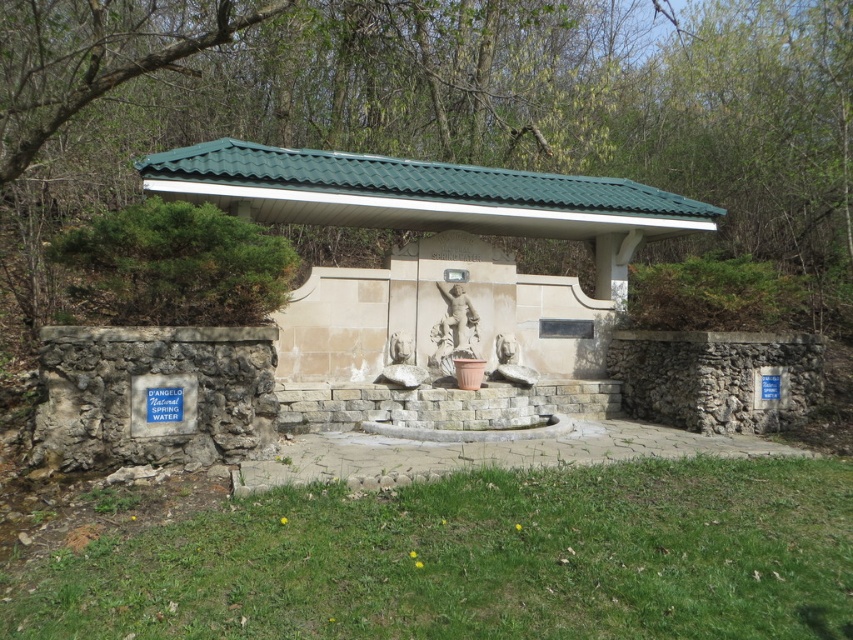
Between green leafy tree at upper center and white stone fountain at center, which one appears on the right side from the viewer's perspective?

green leafy tree at upper center is more to the right.

At what (x,y) coordinates should I click in order to perform the action: click on green leafy tree at upper center. Please return your answer as a coordinate pair (x, y). The width and height of the screenshot is (853, 640). Looking at the image, I should click on click(503, 116).

Locate an element on the screen. The image size is (853, 640). green leafy tree at upper center is located at coordinates (503, 116).